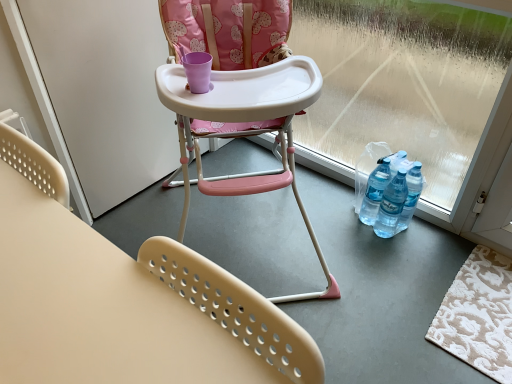
Find the location of `free space to the left of beige textured rug at lower right`. free space to the left of beige textured rug at lower right is located at coordinates (383, 299).